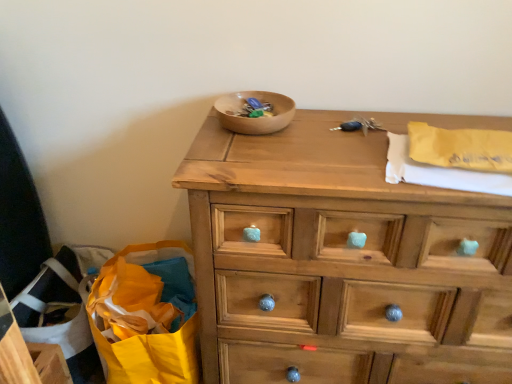
You are a GUI agent. You are given a task and a screenshot of the screen. Output one action in this format:
    pyautogui.click(x=<x>, y=<y>)
    Task: Click on the vacant area that is situated to the right of wooden bowl at center
    
    Given the screenshot: What is the action you would take?
    pyautogui.click(x=327, y=126)